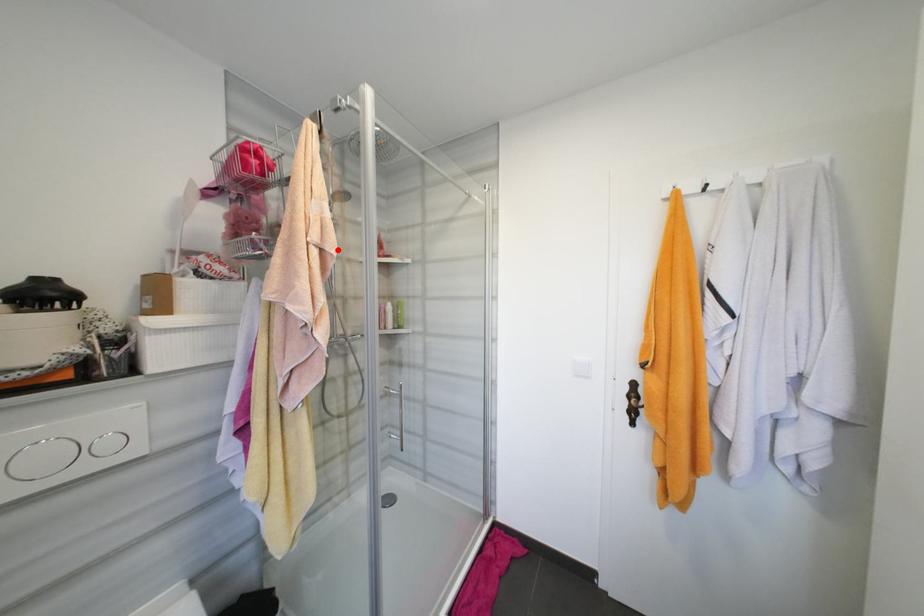
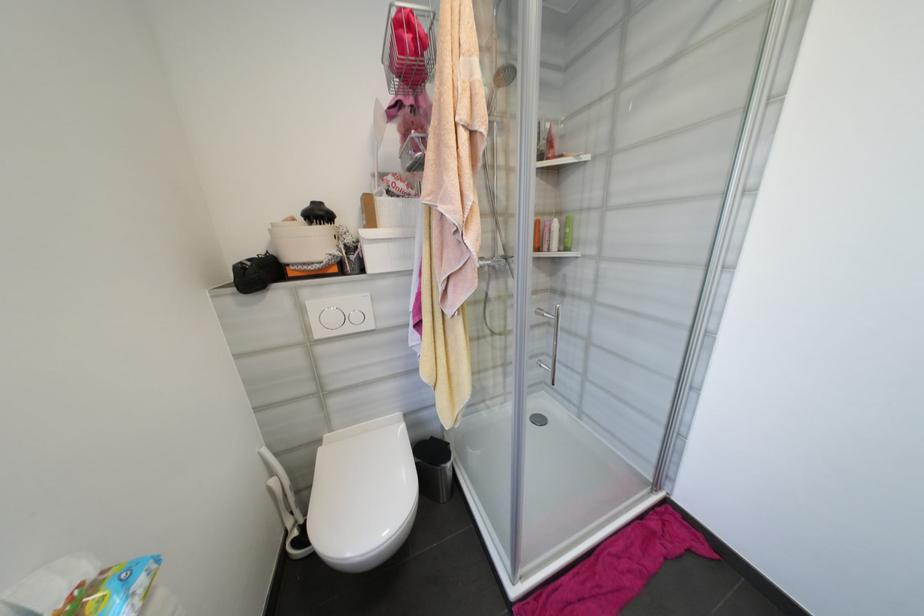
Locate, in the second image, the point that corresponds to the highlighted location in the first image.

(488, 127)